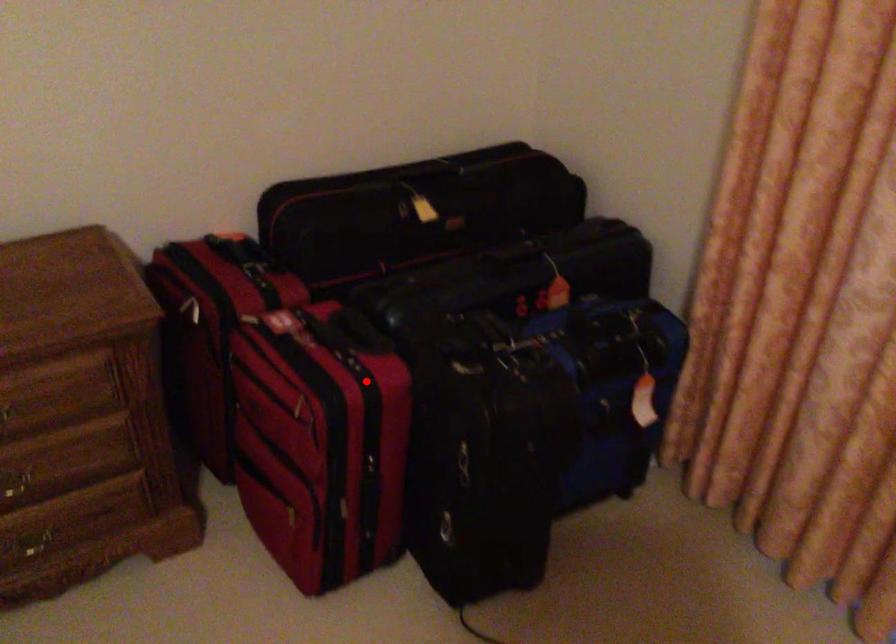
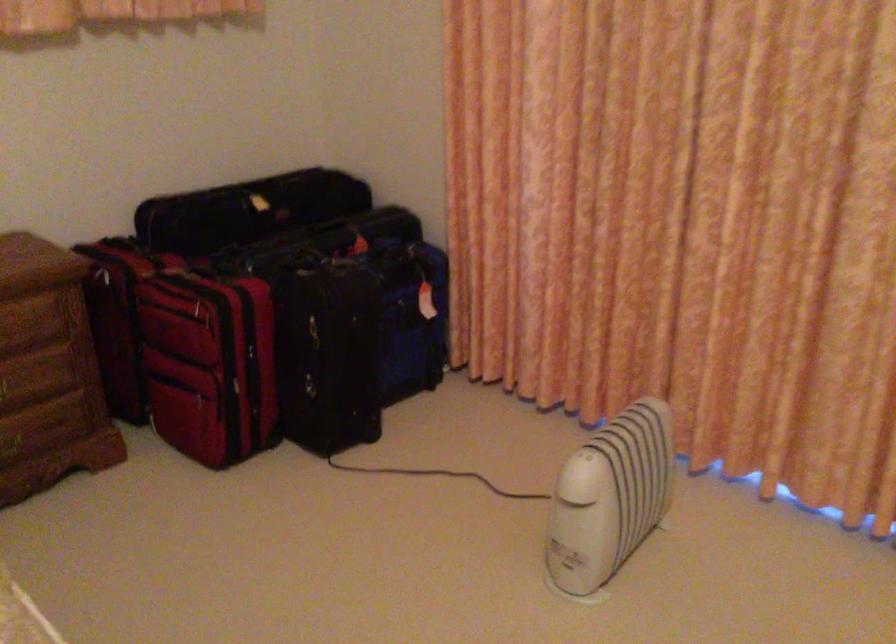
Find the pixel in the second image that matches the highlighted location in the first image.

(243, 292)